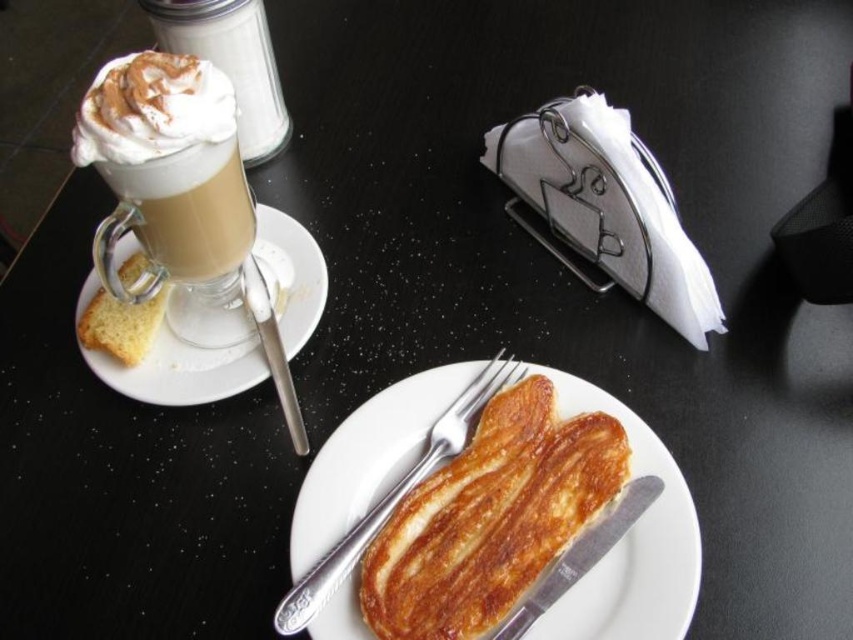
Does golden-brown toasted bread at center appear on the right side of yellowish matte bread at left?

Indeed, golden-brown toasted bread at center is positioned on the right side of yellowish matte bread at left.

Can you confirm if golden-brown toasted bread at center is taller than yellowish matte bread at left?

Correct, golden-brown toasted bread at center is much taller as yellowish matte bread at left.

Does point (608, 579) come closer to viewer compared to point (152, 310)?

Yes, point (608, 579) is closer to viewer.

The width and height of the screenshot is (853, 640). I want to click on golden-brown toasted bread at center, so click(368, 456).

Does silver metallic knife at lower center lie in front of yellowish matte bread at left?

Yes, silver metallic knife at lower center is closer to the viewer.

Identify the location of silver metallic knife at lower center. (579, 556).

Who is more forward, (509, 621) or (294, 432)?

Point (509, 621)

Who is more distant from viewer, (618,520) or (277,365)?

Point (277,365)

Is point (628, 509) positioned before point (256, 280)?

Yes, point (628, 509) is closer to viewer.

Where is `silver metallic knife at lower center`? Image resolution: width=853 pixels, height=640 pixels. silver metallic knife at lower center is located at coordinates (579, 556).